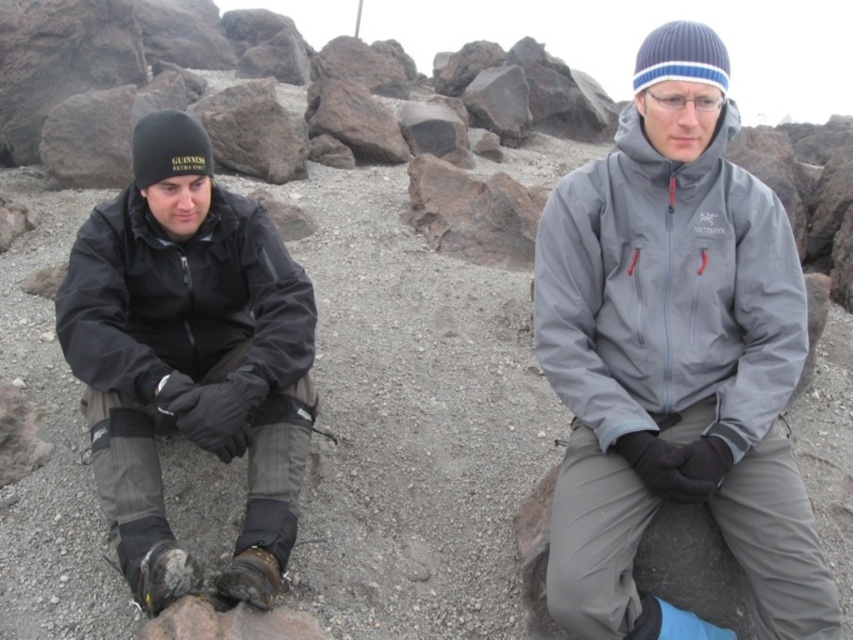
From the picture: You are planning to take a photo of the two jackets in the scene. The photographer wants to ensure that the gray softshell jacket at center is visible above the black matte jacket at left in the final image. Based on the scene description, will this be possible?

Yes, because the gray softshell jacket at center is already located above the black matte jacket at left in the scene, so positioning the camera appropriately should allow the photographer to capture the desired composition.

You are trying to decide which jacket to wear for a hike in a rocky, arid environment. You have the gray softshell jacket at center and the black matte jacket at left. Which jacket would you choose and why?

You should choose the black matte jacket at left because it is larger and provides more coverage, which is better suited for a rocky, arid environment where protection from the terrain and potential weather changes is important.

You are a photographer standing in front of the gray softshell jacket at center. You want to take a photo of it without including any of the large dark rocks scattered around. Based on the description, what is the minimum distance you should stand away from the jacket to ensure the rocks are out of frame?

The gray softshell jacket at center is 2.22 meters from the camera. To avoid including the large dark rocks in the photo, you should stand at least 2.22 meters away from the jacket.